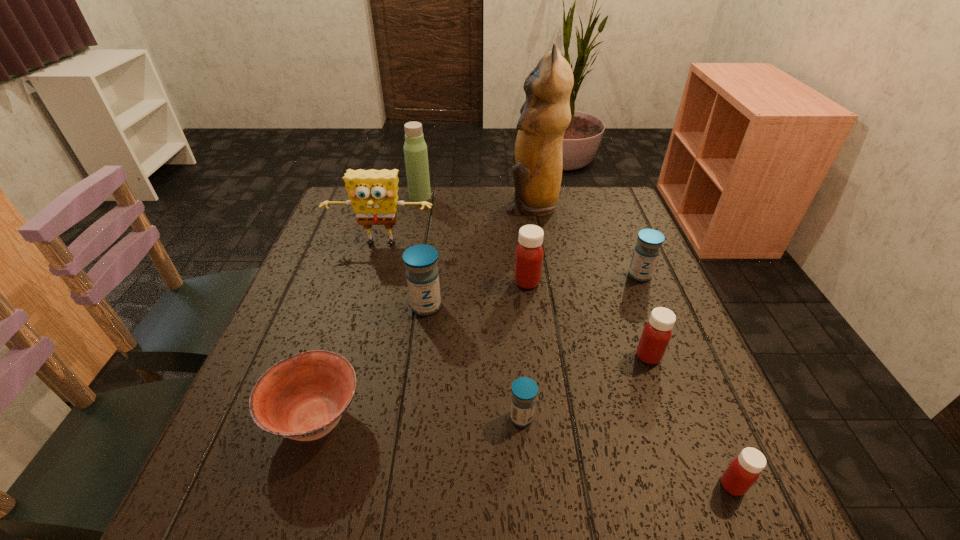
Identify the location of thermos bottle at the far edge. (415, 149).

Locate an element on the screen. object that is at the near edge is located at coordinates (744, 470).

At what (x,y) coordinates should I click in order to perform the action: click on sponge positioned at the left edge. Please return your answer as a coordinate pair (x, y). The height and width of the screenshot is (540, 960). Looking at the image, I should click on (373, 194).

At what (x,y) coordinates should I click in order to perform the action: click on bowl at the left edge. Please return your answer as a coordinate pair (x, y). This screenshot has width=960, height=540. Looking at the image, I should click on (302, 397).

This screenshot has width=960, height=540. Identify the location of object positioned at the near right corner. click(744, 470).

In the image, there is a desktop. At what (x,y) coordinates should I click in order to perform the action: click on vacant space at the far edge. Please return your answer as a coordinate pair (x, y). Looking at the image, I should click on (568, 221).

In the image, there is a desktop. Identify the location of vacant region at the near edge. (495, 526).

In the image, there is a desktop. In order to click on vacant region at the left edge in this screenshot , I will do `click(339, 286)`.

I want to click on vacant position at the right edge of the desktop, so click(x=636, y=313).

You are a GUI agent. You are given a task and a screenshot of the screen. Output one action in this format:
    pyautogui.click(x=<x>, y=<y>)
    Task: Click on the free space between the bowl and the yellow sponge
    
    Given the screenshot: What is the action you would take?
    pyautogui.click(x=348, y=332)